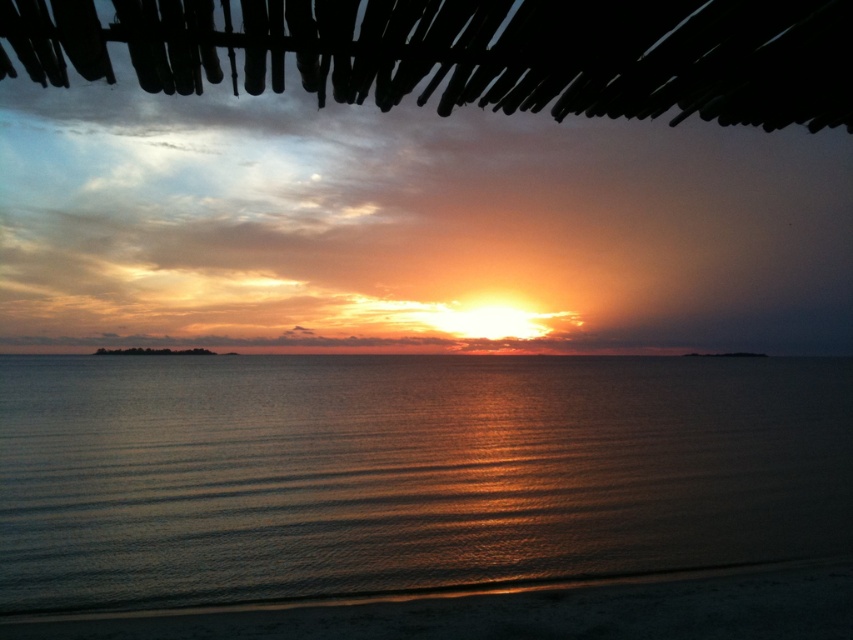
Question: Is shiny metallic water at center to the right of sandy beach at lower center from the viewer's perspective?

Choices:
 (A) no
 (B) yes

Answer: (A)

Question: Which point is farther from the camera taking this photo?

Choices:
 (A) (770, 620)
 (B) (45, 512)

Answer: (B)

Question: Where is shiny metallic water at center located in relation to sandy beach at lower center in the image?

Choices:
 (A) below
 (B) above

Answer: (A)

Question: Is shiny metallic water at center to the left of sandy beach at lower center from the viewer's perspective?

Choices:
 (A) no
 (B) yes

Answer: (B)